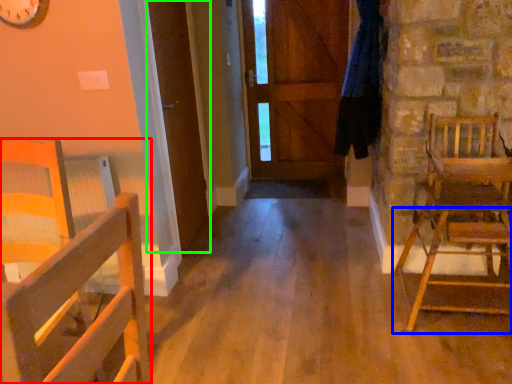
Question: Considering the real-world distances, which object is farthest from chair (highlighted by a red box)? chair (highlighted by a blue box) or door (highlighted by a green box)?

Choices:
 (A) chair
 (B) door

Answer: (A)